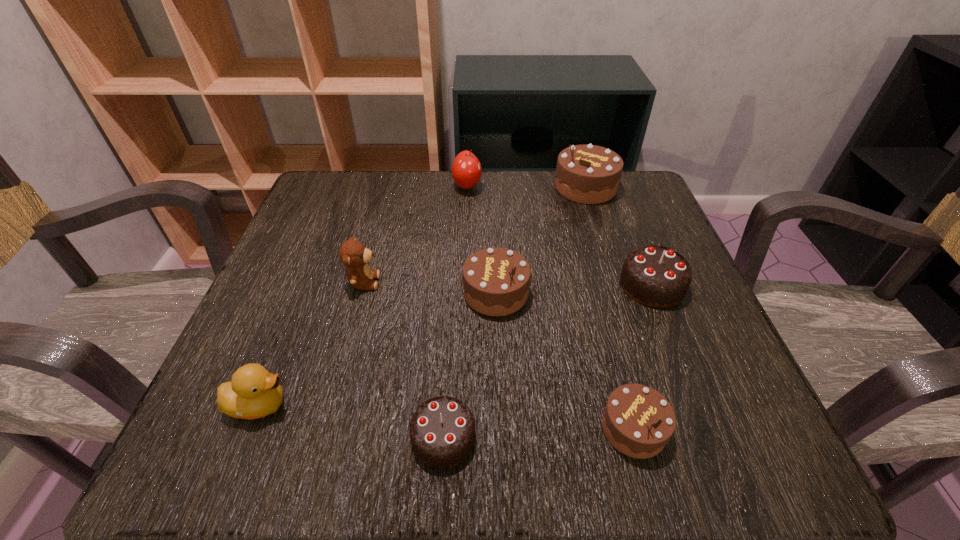
The image size is (960, 540). I want to click on the biggest brown chocolate cake, so click(588, 174).

The width and height of the screenshot is (960, 540). I want to click on the tallest chocolate cake, so click(x=588, y=174).

At what (x,y) coordinates should I click in order to perform the action: click on apple. Please return your answer as a coordinate pair (x, y). Image resolution: width=960 pixels, height=540 pixels. Looking at the image, I should click on (466, 170).

Locate an element on the screen. teddy bear is located at coordinates click(353, 254).

Where is `the seventh object from right to left`? This screenshot has width=960, height=540. the seventh object from right to left is located at coordinates (353, 254).

Where is `the second farthest brown chocolate cake`? The image size is (960, 540). the second farthest brown chocolate cake is located at coordinates (496, 281).

Identify the location of the second smallest brown chocolate cake. (496, 281).

Identify the location of the farther chocolate chocolate cake. (655, 276).

Where is `the bigger chocolate chocolate cake`? the bigger chocolate chocolate cake is located at coordinates (655, 276).

The height and width of the screenshot is (540, 960). In order to click on the leftmost object in this screenshot , I will do `click(253, 392)`.